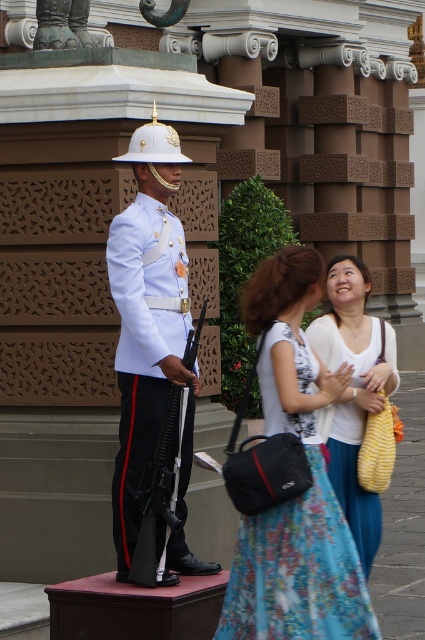
You are a photographer taking a picture of the ceremonial guard in front of the palace. You notice two points marked in the scene. The first point is at coordinate point (x=224, y=596) and the second is at point (x=135, y=237). Which point is nearer to your camera lens?

Point (x=224, y=596) is closer to the camera than point (x=135, y=237).

You are a photographer planning to capture a photo of the ceremonial guard and a visitor in front of the palace. The visitor is wearing a white fabric dress at center. The ceremonial guard is wearing a white glossy uniform at center. Based on their sizes, which clothing item would you position closer to the camera to ensure both appear proportionally balanced in the photo?

The white glossy uniform at center is smaller in size compared to the white fabric dress at center. To balance their sizes in the photo, position the white glossy uniform at center closer to the camera so it appears larger, while placing the white fabric dress at center slightly farther back to make it look smaller.